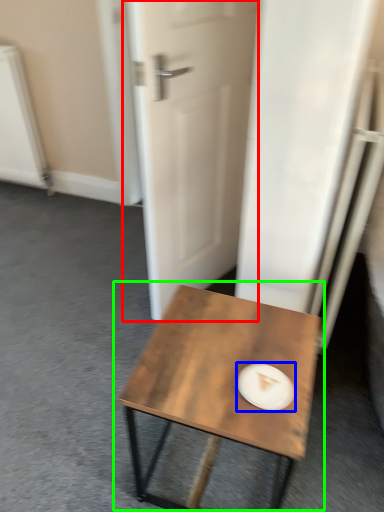
Question: Which is nearer to the door (highlighted by a red box)? paper plate (highlighted by a blue box) or coffee table (highlighted by a green box).

Choices:
 (A) paper plate
 (B) coffee table

Answer: (B)